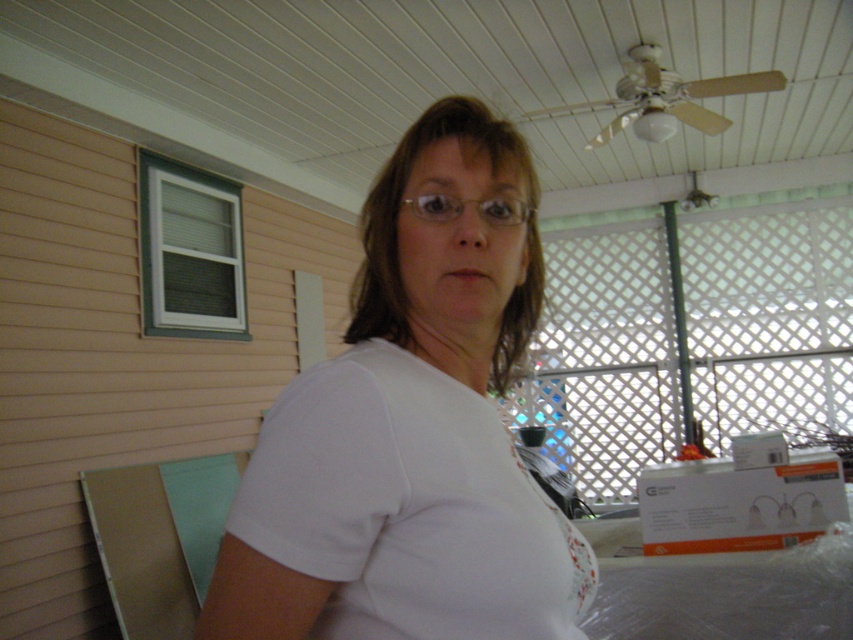
Does white cotton t-shirt at center have a lesser height compared to gold-framed glasses at center?

Incorrect, white cotton t-shirt at center's height does not fall short of gold-framed glasses at center's.

Who is lower down, white cotton t-shirt at center or gold-framed glasses at center?

white cotton t-shirt at center

Measure the distance between point (265, 552) and camera.

They are 21.73 inches apart.

Where is `white cotton t-shirt at center`? Image resolution: width=853 pixels, height=640 pixels. white cotton t-shirt at center is located at coordinates (408, 508).